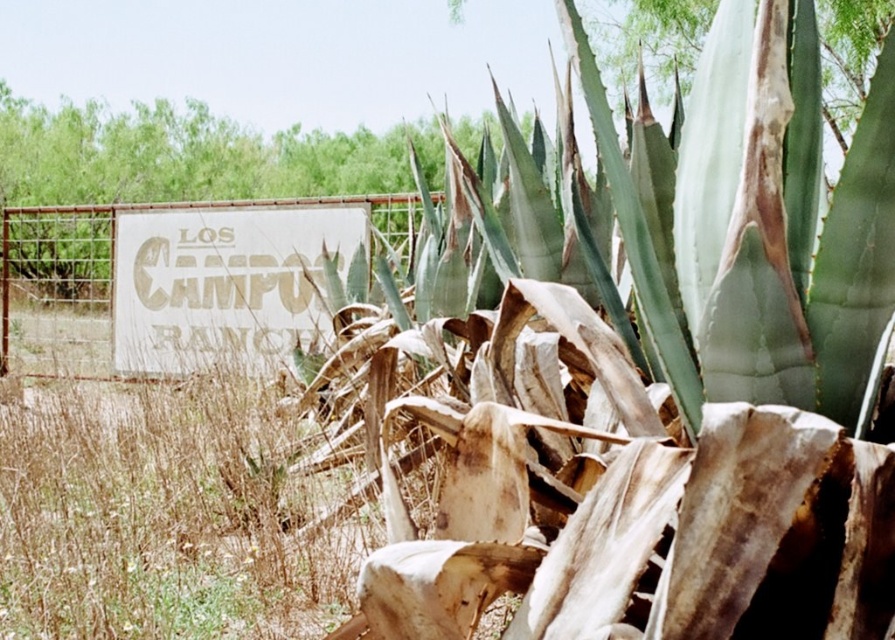
You are a hiker who wants to read the sign at LOS CAMPOS RANCHO. You see the white textured sign at center and the rusty metal fence at left. Which object is taller?

The white textured sign at center is taller than the rusty metal fence at left.

You are standing in a rural area and want to read the white textured sign at center. The rusty metal fence at left is blocking your view. Can you move closer to the sign without moving past the fence?

The white textured sign at center is closer to the viewer than the rusty metal fence at left, so you can move closer to the sign without moving past the fence to read it.